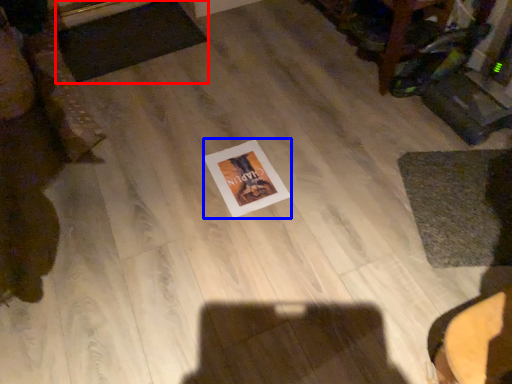
Question: Which of the following is the closest to the observer, mat (highlighted by a red box) or postcard (highlighted by a blue box)?

Choices:
 (A) mat
 (B) postcard

Answer: (B)